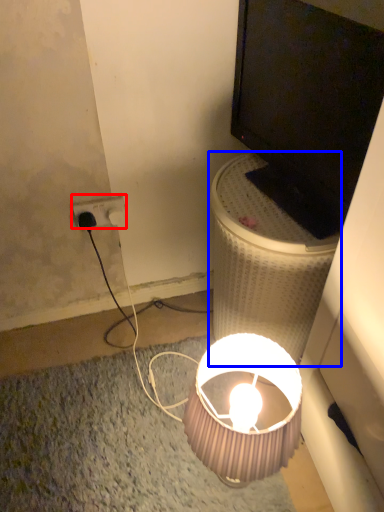
Question: Which point is further to the camera, power outlet (highlighted by a red box) or table (highlighted by a blue box)?

Choices:
 (A) power outlet
 (B) table

Answer: (A)